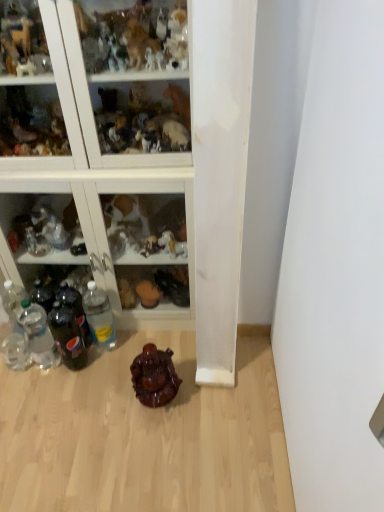
You are a GUI agent. You are given a task and a screenshot of the screen. Output one action in this format:
    pyautogui.click(x=<x>, y=<y>)
    Task: Click on the free space in front of black plastic bottles at left, which is the 3th bottle from right to left
    
    Given the screenshot: What is the action you would take?
    (79, 382)